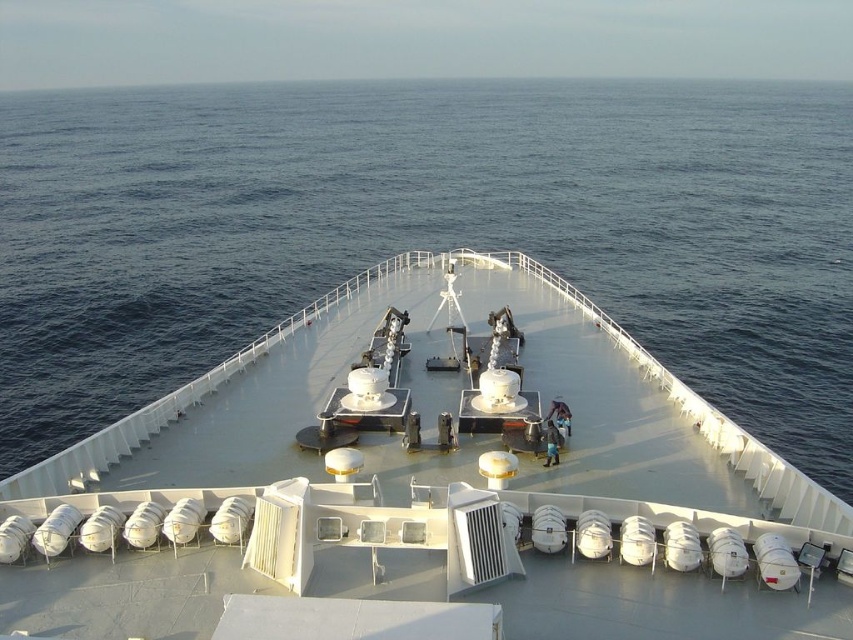
You are a passenger on the ship and want to know if the white matte boat at center can fit entirely within the blue water at center. Based on their widths, can it?

The white matte boat at center is narrower than the blue water at center, so it can fit entirely within the blue water at center.

You are standing on the deck of the ship and want to take a photo of both the radar domes and the lifeboats. You notice two points marked on your map at coordinates point (84, 588) and point (67, 147). Which point should you stand closer to in order to ensure both the radar domes and the lifeboats are in frame?

You should stand closer to point (84, 588) because it is closer to the camera, allowing you to capture both the radar domes and the lifeboats in the frame.